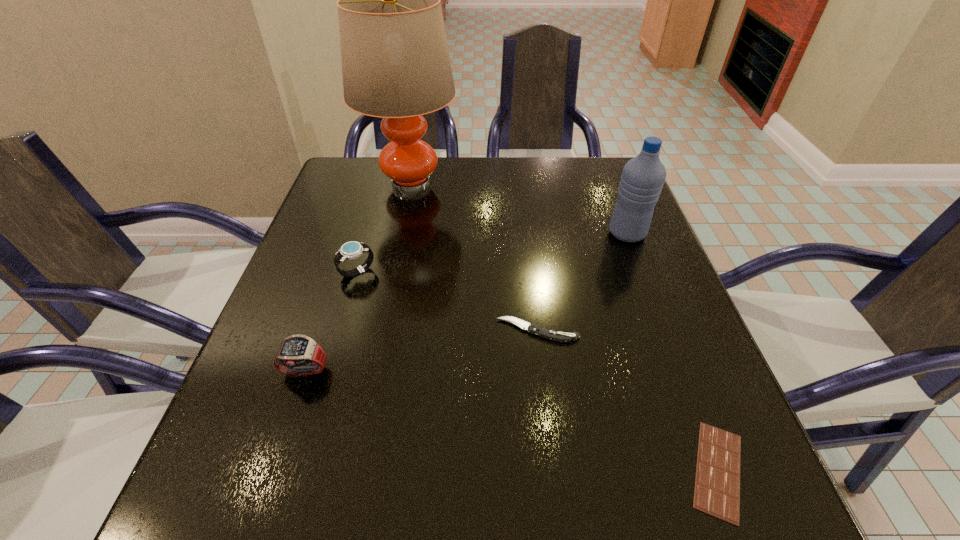
The width and height of the screenshot is (960, 540). In order to click on chocolate bar that is at the right edge in this screenshot , I will do `click(717, 481)`.

Where is `object present at the far left corner`? The image size is (960, 540). object present at the far left corner is located at coordinates tap(395, 60).

The image size is (960, 540). What are the coordinates of `object that is positioned at the near right corner` in the screenshot? It's located at (717, 481).

Locate an element on the screen. This screenshot has height=540, width=960. free space at the far edge is located at coordinates (534, 177).

At what (x,y) coordinates should I click in order to perform the action: click on blank space at the near edge of the desktop. Please return your answer as a coordinate pair (x, y). Looking at the image, I should click on (381, 528).

Find the location of a particular element. The width and height of the screenshot is (960, 540). vacant space at the left edge of the desktop is located at coordinates (301, 295).

Image resolution: width=960 pixels, height=540 pixels. In the image, there is a desktop. Find the location of `vacant space at the right edge`. vacant space at the right edge is located at coordinates (599, 296).

In the image, there is a desktop. At what (x,y) coordinates should I click in order to perform the action: click on free space at the far left corner. Please return your answer as a coordinate pair (x, y). This screenshot has height=540, width=960. Looking at the image, I should click on (385, 203).

Locate an element on the screen. vacant space at the far right corner of the desktop is located at coordinates (582, 177).

I want to click on free area in between the lamp and the nearer watch, so click(x=358, y=278).